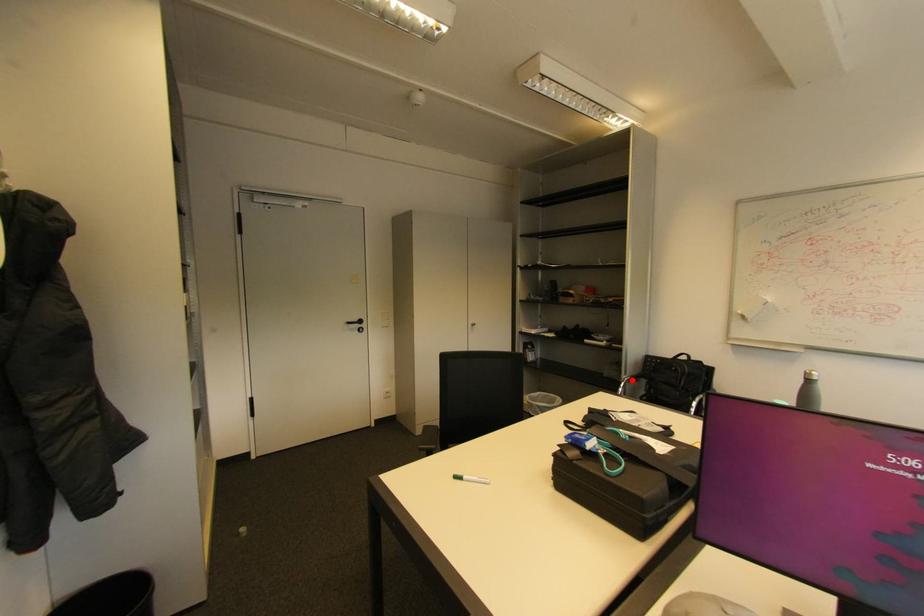
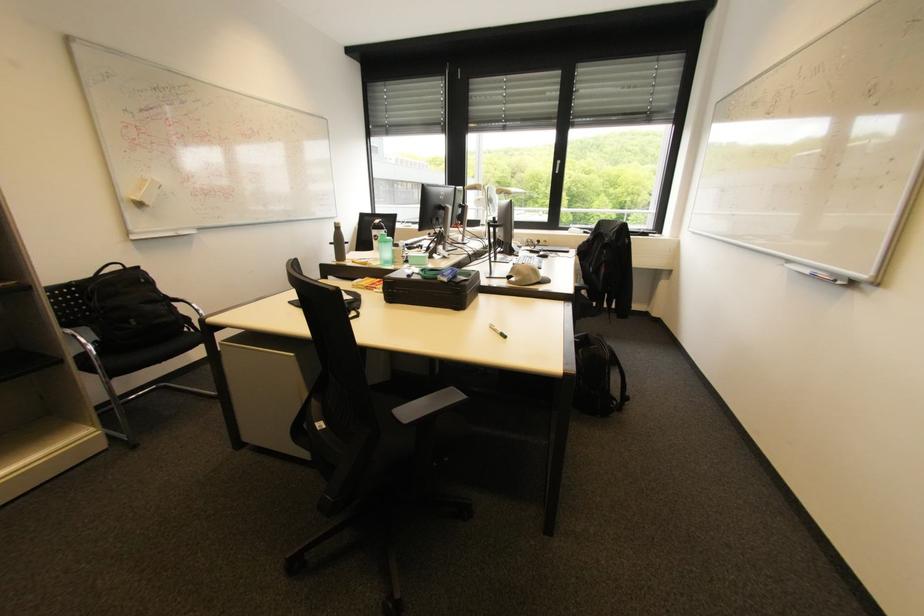
In the second image, find the point that corresponds to the highlighted location in the first image.

(74, 331)